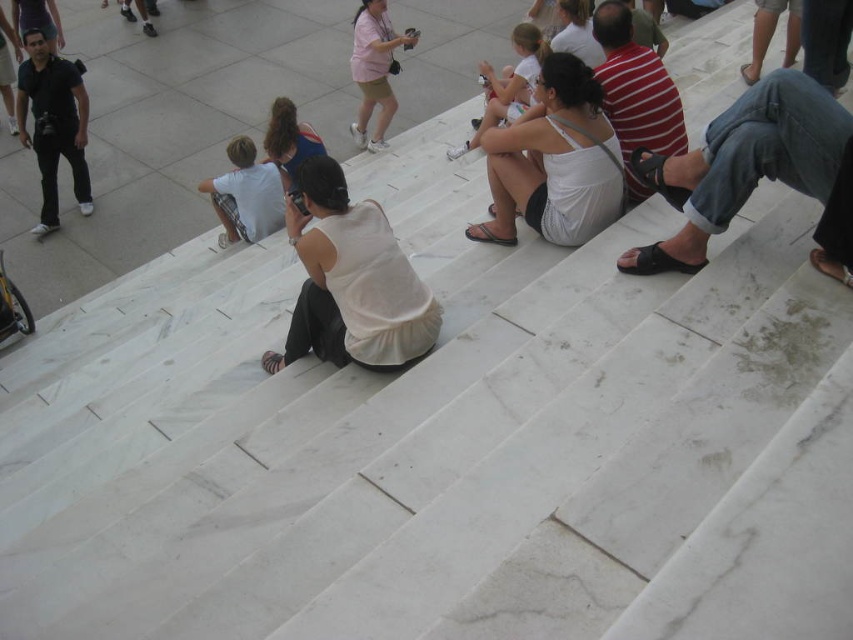
In the scene shown: You are a photographer planning to take a candid shot of the people on the white marble steps. You notice the white fabric dress at center and the striped cotton shirt at center. Which one is positioned lower from your viewpoint?

The white fabric dress at center is located below striped cotton shirt at center, so the white fabric dress at center is positioned lower from your viewpoint.

You are a photographer trying to capture a candid shot of the matte blue tank top at center without being noticed by the matte black camera at left. How far apart are the two objects?

The matte black camera at left and the matte blue tank top at center are 2.89 meters apart. This distance allows the photographer to position themselves far enough from the matte black camera at left to avoid detection while capturing the matte blue tank top at center.